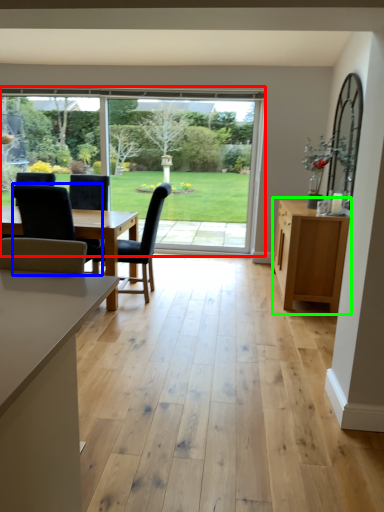
Question: Which object is the farthest from window (highlighted by a red box)? Choose among these: chair (highlighted by a blue box) or cabinetry (highlighted by a green box).

Choices:
 (A) chair
 (B) cabinetry

Answer: (A)